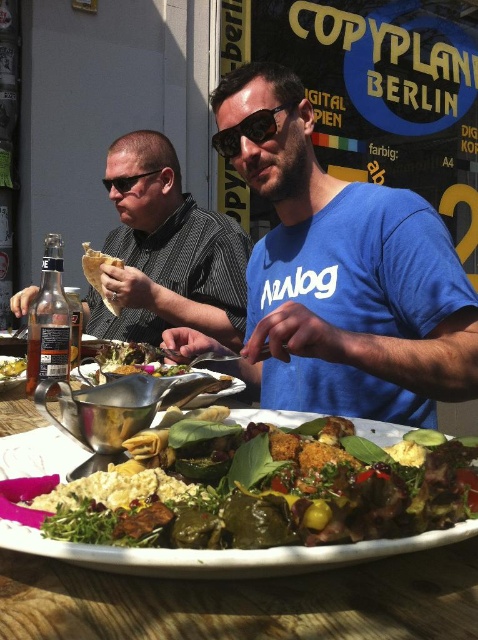
You are a food photographer and need to ensure that the blue cotton shirt at center and the yellowish matte hummus at center are both visible in your shot. Given their sizes, which one might require more careful framing to avoid being overshadowed?

The yellowish matte hummus at center is smaller than the blue cotton shirt at center, so it might require more careful framing to ensure it doesn

You are a photographer trying to capture a closeup of the food on the plate. You notice two points of interest marked as point 1 at coordinates point (186, 275) and point 2 at coordinates point (234, 140). Which point should you focus on to ensure the subject is in the foreground of your shot?

You should focus on point 1 at coordinates point (186, 275) because it is further to the camera than point 2 at coordinates point (234, 140), making it part of the foreground.